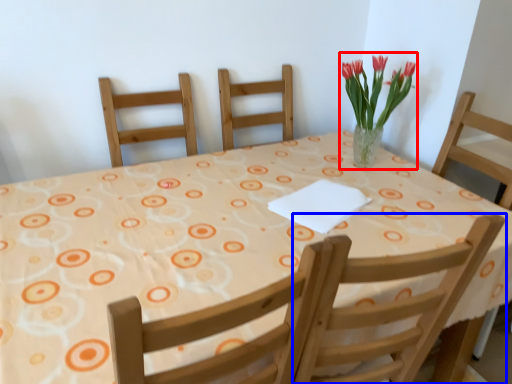
Question: Among these objects, which one is farthest to the camera, floral arrangement (highlighted by a red box) or chair (highlighted by a blue box)?

Choices:
 (A) floral arrangement
 (B) chair

Answer: (A)